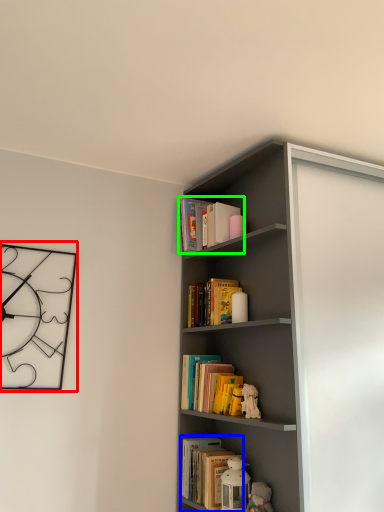
Question: Based on their relative distances, which object is farther from clock (highlighted by a red box)? Choose from book (highlighted by a blue box) and book (highlighted by a green box).

Choices:
 (A) book
 (B) book

Answer: (A)